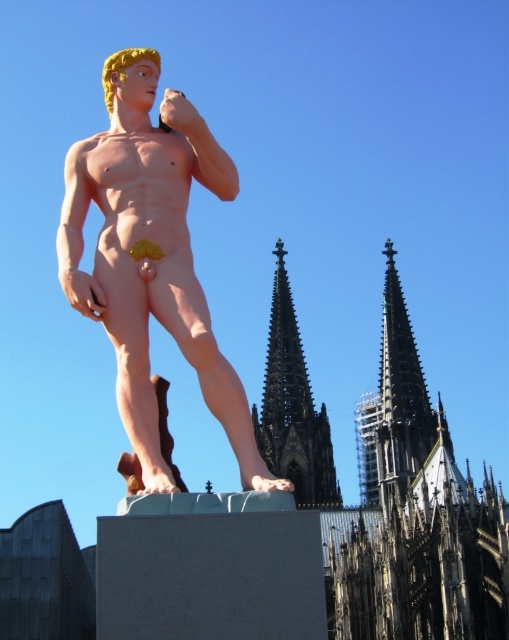
Question: Among these objects, which one is farthest from the camera?

Choices:
 (A) pink matte statue at center
 (B) dark gray stone spire at upper right
 (C) dark gray stone spire at upper center

Answer: (C)

Question: Among these points, which one is farthest from the camera?

Choices:
 (A) (286, 413)
 (B) (173, 323)
 (C) (386, 435)

Answer: (A)

Question: Considering the real-world distances, which object is farthest from the pink matte statue at center?

Choices:
 (A) dark gray stone spire at upper right
 (B) dark gray stone spire at upper center

Answer: (B)

Question: Observing the image, what is the correct spatial positioning of dark gray stone spire at upper right in reference to dark gray stone spire at upper center?

Choices:
 (A) right
 (B) left

Answer: (A)

Question: Can you confirm if dark gray stone spire at upper right is bigger than dark gray stone spire at upper center?

Choices:
 (A) yes
 (B) no

Answer: (A)

Question: Is pink matte statue at center in front of dark gray stone spire at upper right?

Choices:
 (A) yes
 (B) no

Answer: (A)